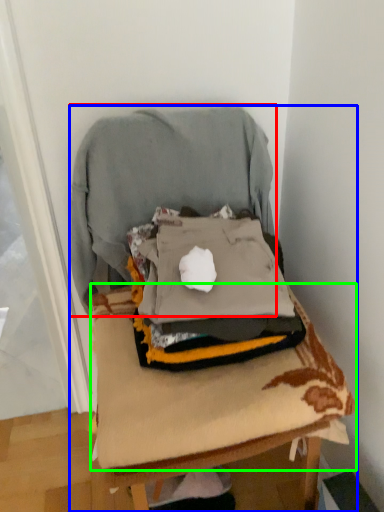
Question: Which object is the farthest from sweatshirt (highlighted by a red box)? Choose among these: furniture (highlighted by a blue box) or sheet (highlighted by a green box).

Choices:
 (A) furniture
 (B) sheet

Answer: (B)